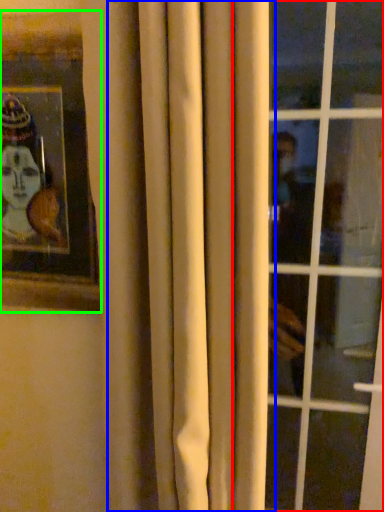
Question: Which is nearer to the window (highlighted by a red box)? curtain (highlighted by a blue box) or picture frame (highlighted by a green box).

Choices:
 (A) curtain
 (B) picture frame

Answer: (A)